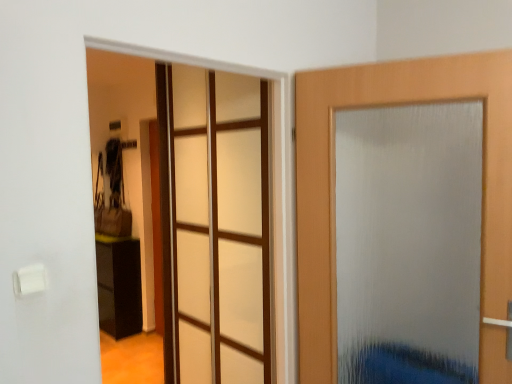
The width and height of the screenshot is (512, 384). Describe the element at coordinates (214, 225) in the screenshot. I see `transparent glass door at center` at that location.

You are a GUI agent. You are given a task and a screenshot of the screen. Output one action in this format:
    pyautogui.click(x=<x>, y=<y>)
    Task: Click on the frosted glass door at right
    
    Given the screenshot: What is the action you would take?
    (x=334, y=177)

The height and width of the screenshot is (384, 512). Identify the location of transparent glass door at center. (214, 225).

Is black glossy cabinet at lower left far away from frosted glass door at right?

Absolutely, black glossy cabinet at lower left is distant from frosted glass door at right.

From a real-world perspective, between black glossy cabinet at lower left and frosted glass door at right, who is vertically higher?

frosted glass door at right is physically above.

Can you tell me how much black glossy cabinet at lower left and frosted glass door at right differ in facing direction?

25.5 degrees.

Can you confirm if black glossy cabinet at lower left is shorter than frosted glass door at right?

Yes.

Considering the positions of objects transparent glass door at center and frosted glass door at right in the image provided, who is behind, transparent glass door at center or frosted glass door at right?

transparent glass door at center is more distant.

From the image's perspective, is transparent glass door at center positioned above or below frosted glass door at right?

Based on their image positions, transparent glass door at center is located beneath frosted glass door at right.

Is transparent glass door at center turned away from frosted glass door at right?

That's not correct — transparent glass door at center is not looking away from frosted glass door at right.

Does transparent glass door at center contain frosted glass door at right?

No, frosted glass door at right is not inside transparent glass door at center.

Is transparent glass door at center behind black glossy cabinet at lower left?

No, the depth of transparent glass door at center is less than that of black glossy cabinet at lower left.

From the picture: Can you confirm if transparent glass door at center is positioned to the right of black glossy cabinet at lower left?

Yes.

Who is taller, transparent glass door at center or black glossy cabinet at lower left?

transparent glass door at center is taller.

From a real-world perspective, which is physically below, transparent glass door at center or black glossy cabinet at lower left?

black glossy cabinet at lower left.

From the image's perspective, between black glossy cabinet at lower left and transparent glass door at center, who is located below?

black glossy cabinet at lower left, from the image's perspective.

From the picture: Considering the sizes of black glossy cabinet at lower left and transparent glass door at center in the image, is black glossy cabinet at lower left wider or thinner than transparent glass door at center?

black glossy cabinet at lower left is wider than transparent glass door at center.

In the scene shown: Considering the sizes of black glossy cabinet at lower left and transparent glass door at center in the image, is black glossy cabinet at lower left bigger or smaller than transparent glass door at center?

Considering their sizes, black glossy cabinet at lower left takes up less space than transparent glass door at center.

Is frosted glass door at right far away from black glossy cabinet at lower left?

That's right, there is a large distance between frosted glass door at right and black glossy cabinet at lower left.

Measure the distance from frosted glass door at right to black glossy cabinet at lower left.

A distance of 9.34 feet exists between frosted glass door at right and black glossy cabinet at lower left.

Is frosted glass door at right closer to the viewer compared to black glossy cabinet at lower left?

Yes, frosted glass door at right is closer to the viewer.

Is frosted glass door at right not near transparent glass door at center?

frosted glass door at right is near transparent glass door at center, not far away.

Which object is wider, frosted glass door at right or transparent glass door at center?

Wider between the two is frosted glass door at right.

Is frosted glass door at right oriented away from transparent glass door at center?

frosted glass door at right does not have its back to transparent glass door at center.

From the image's perspective, is frosted glass door at right over transparent glass door at center?

Yes, from the image's perspective, frosted glass door at right is on top of transparent glass door at center.

This screenshot has height=384, width=512. I want to click on furniture on the left of the frosted glass door at right, so click(x=119, y=286).

I want to click on glass door that appears below the frosted glass door at right (from a real-world perspective), so click(x=214, y=225).

Based on their spatial positions, is frosted glass door at right or black glossy cabinet at lower left further from transparent glass door at center?

black glossy cabinet at lower left lies further to transparent glass door at center than the other object.

Based on their spatial positions, is black glossy cabinet at lower left or frosted glass door at right closer to transparent glass door at center?

frosted glass door at right is closer to transparent glass door at center.

When comparing their distances from black glossy cabinet at lower left, does frosted glass door at right or transparent glass door at center seem closer?

Based on the image, transparent glass door at center appears to be nearer to black glossy cabinet at lower left.

From the image, which object appears to be farther from frosted glass door at right, black glossy cabinet at lower left or transparent glass door at center?

Based on the image, black glossy cabinet at lower left appears to be further to frosted glass door at right.

Which object lies further to the anchor point black glossy cabinet at lower left, transparent glass door at center or frosted glass door at right?

frosted glass door at right lies further to black glossy cabinet at lower left than the other object.

In the scene shown: Estimate the real-world distances between objects in this image. Which object is further from frosted glass door at right, transparent glass door at center or black glossy cabinet at lower left?

Based on the image, black glossy cabinet at lower left appears to be further to frosted glass door at right.

You are a GUI agent. You are given a task and a screenshot of the screen. Output one action in this format:
    pyautogui.click(x=<x>, y=<y>)
    Task: Click on the glass door located between frosted glass door at right and black glossy cabinet at lower left in the depth direction
    The width and height of the screenshot is (512, 384).
    Given the screenshot: What is the action you would take?
    pyautogui.click(x=214, y=225)